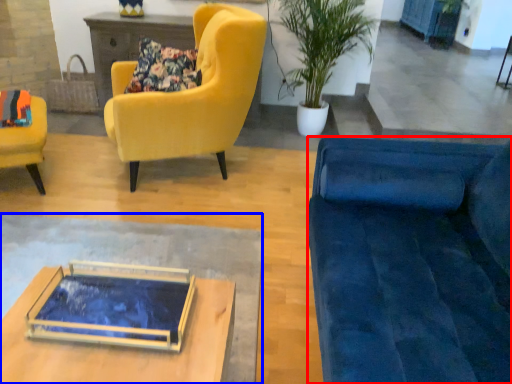
Question: Which of the following is the closest to the observer, studio couch (highlighted by a red box) or desk (highlighted by a blue box)?

Choices:
 (A) studio couch
 (B) desk

Answer: (A)